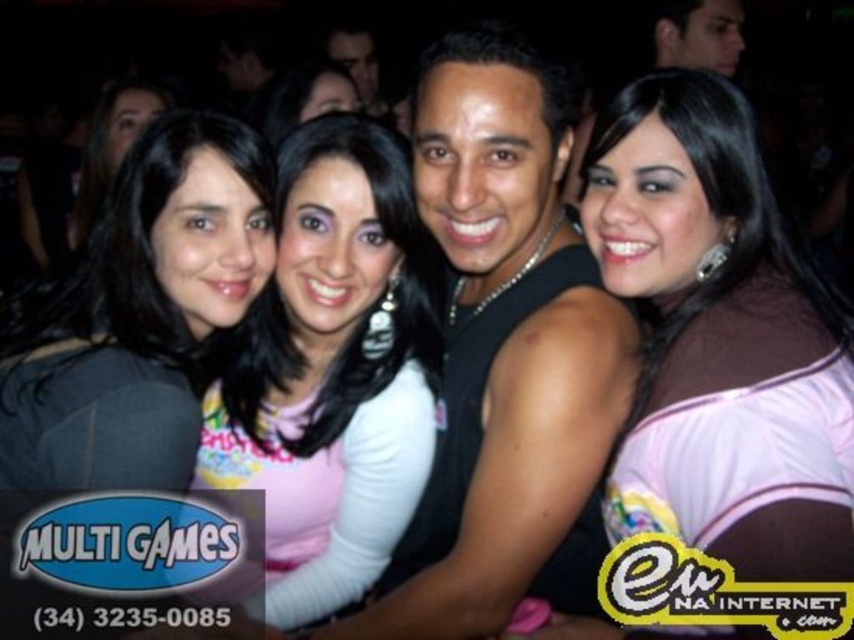
Question: Can you confirm if black matte tank top at center is thinner than pink fabric shirt at center?

Choices:
 (A) no
 (B) yes

Answer: (A)

Question: Can you confirm if pink fabric shirt at center is positioned to the left of matte pink shirt at center?

Choices:
 (A) no
 (B) yes

Answer: (A)

Question: Does black matte tank top at center come behind matte black shirt at left?

Choices:
 (A) no
 (B) yes

Answer: (B)

Question: Estimate the real-world distances between objects in this image. Which object is farther from the matte pink shirt at center?

Choices:
 (A) pink sheer top at center
 (B) pink fabric shirt at center

Answer: (A)

Question: Which of the following is the farthest from the observer?

Choices:
 (A) black matte tank top at center
 (B) matte black hair at center
 (C) matte pink shirt at center
 (D) pink fabric shirt at center

Answer: (B)

Question: Which point is farther to the camera?

Choices:
 (A) (603, 323)
 (B) (92, 221)

Answer: (B)